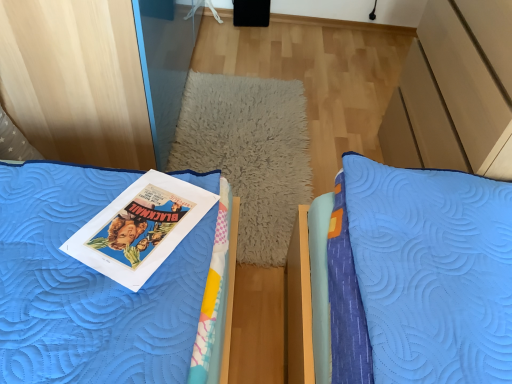
Locate an element on the screen. unoccupied space behind white fluffy pillow at center is located at coordinates (296, 62).